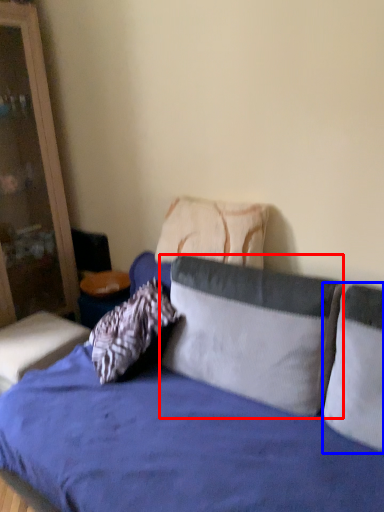
Question: Which of the following is the closest to the observer, pillow (highlighted by a red box) or pillow (highlighted by a blue box)?

Choices:
 (A) pillow
 (B) pillow

Answer: (B)